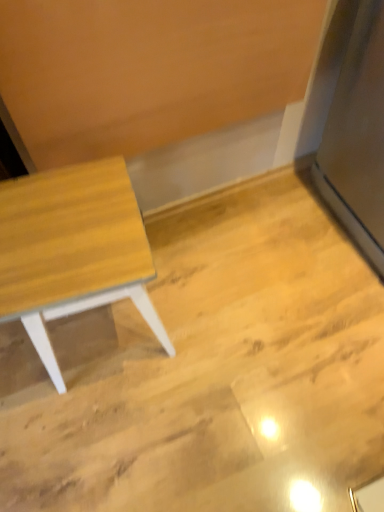
Where is `light wood table at left`? The image size is (384, 512). light wood table at left is located at coordinates (72, 250).

What is the approximate width of light wood table at left?

The width of light wood table at left is 31.07 centimeters.

Describe the element at coordinates (72, 250) in the screenshot. The image size is (384, 512). I see `light wood table at left` at that location.

Where is `satin silver fridge at right`? The height and width of the screenshot is (512, 384). satin silver fridge at right is located at coordinates (358, 136).

The height and width of the screenshot is (512, 384). What do you see at coordinates (358, 136) in the screenshot?
I see `satin silver fridge at right` at bounding box center [358, 136].

I want to click on light wood table at left, so click(x=72, y=250).

Consider the image. Does light wood table at left appear on the left side of satin silver fridge at right?

Yes, light wood table at left is to the left of satin silver fridge at right.

Which object is further away from the camera taking this photo, light wood table at left or satin silver fridge at right?

Positioned behind is light wood table at left.

Is point (111, 274) positioned behind point (331, 143)?

No, it is not.

From the image's perspective, which one is positioned higher, light wood table at left or satin silver fridge at right?

satin silver fridge at right.

In the scene shown: From a real-world perspective, is light wood table at left physically located above or below satin silver fridge at right?

light wood table at left is below satin silver fridge at right.

Can you confirm if light wood table at left is thinner than satin silver fridge at right?

Indeed, light wood table at left has a lesser width compared to satin silver fridge at right.

Who is taller, light wood table at left or satin silver fridge at right?

Standing taller between the two is satin silver fridge at right.

Between light wood table at left and satin silver fridge at right, which one has larger size?

Bigger between the two is satin silver fridge at right.

Would you say light wood table at left is inside or outside satin silver fridge at right?

light wood table at left cannot be found inside satin silver fridge at right.

Is light wood table at left touching satin silver fridge at right?

No, light wood table at left is not with satin silver fridge at right.

Could you tell me if light wood table at left is facing satin silver fridge at right?

No, light wood table at left is not facing towards satin silver fridge at right.

Can you tell me how much light wood table at left and satin silver fridge at right differ in facing direction?

The angular difference between light wood table at left and satin silver fridge at right is 84.1 degrees.

Where is `fridge above the light wood table at left (from the image's perspective)`? The width and height of the screenshot is (384, 512). fridge above the light wood table at left (from the image's perspective) is located at coordinates (358, 136).

Does satin silver fridge at right appear on the left side of light wood table at left?

In fact, satin silver fridge at right is to the right of light wood table at left.

Between satin silver fridge at right and light wood table at left, which one is positioned in front?

satin silver fridge at right is more forward.

Is point (358, 70) in front of point (89, 253)?

No, it is not.

From the image's perspective, would you say satin silver fridge at right is shown under light wood table at left?

No.

From a real-world perspective, is satin silver fridge at right physically below light wood table at left?

Actually, satin silver fridge at right is physically above light wood table at left in the real world.

Can you confirm if satin silver fridge at right is thinner than light wood table at left?

In fact, satin silver fridge at right might be wider than light wood table at left.

Considering the sizes of satin silver fridge at right and light wood table at left in the image, is satin silver fridge at right taller or shorter than light wood table at left?

In the image, satin silver fridge at right appears to be taller than light wood table at left.

Is satin silver fridge at right bigger than light wood table at left?

Correct, satin silver fridge at right is larger in size than light wood table at left.

Is satin silver fridge at right surrounding light wood table at left?

No.

Is satin silver fridge at right directly adjacent to light wood table at left?

They are not placed beside each other.

Is light wood table at left at the back of satin silver fridge at right?

No, light wood table at left is not at the back of satin silver fridge at right.

At what (x,y) coordinates should I click in order to perform the action: click on fridge that appears above the light wood table at left (from a real-world perspective). Please return your answer as a coordinate pair (x, y). This screenshot has width=384, height=512. Looking at the image, I should click on (358, 136).

At what (x,y) coordinates should I click in order to perform the action: click on table behind the satin silver fridge at right. Please return your answer as a coordinate pair (x, y). Looking at the image, I should click on (72, 250).

The height and width of the screenshot is (512, 384). I want to click on fridge that appears on the right of light wood table at left, so click(x=358, y=136).